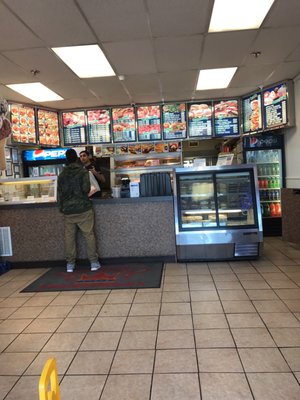
Locate an element on the screen. The image size is (300, 400). counter is located at coordinates (126, 199).